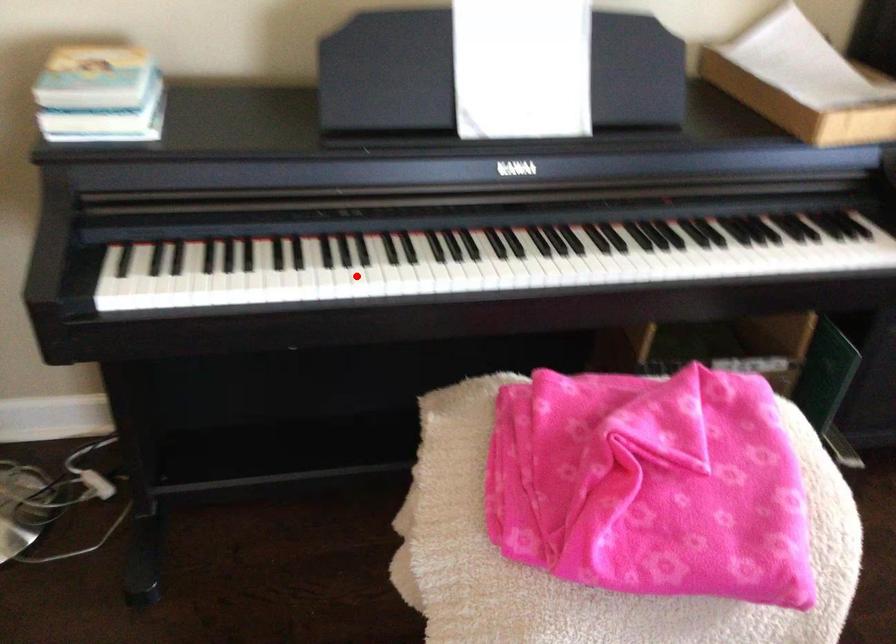
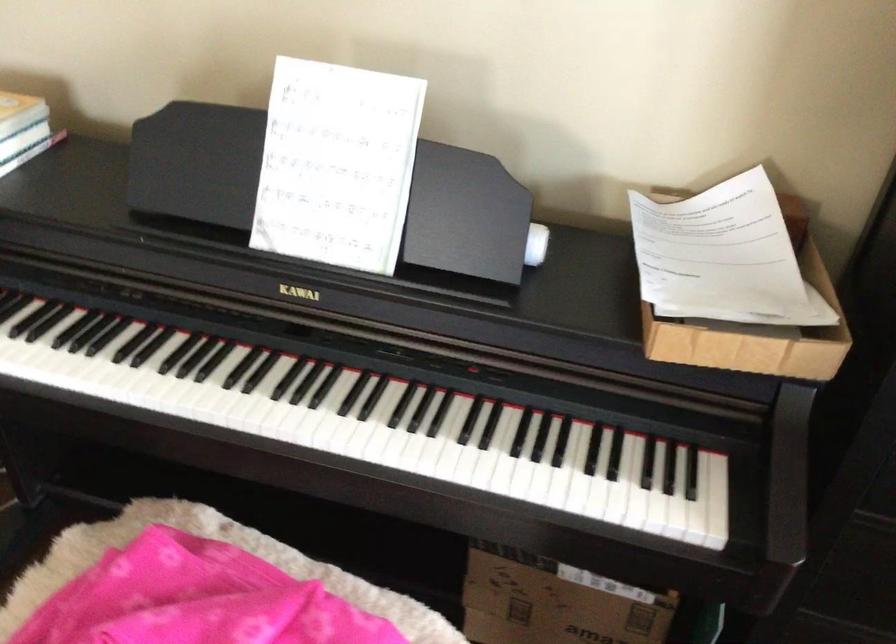
Where in the second image is the point corresponding to the highlighted location from the first image?

(58, 368)